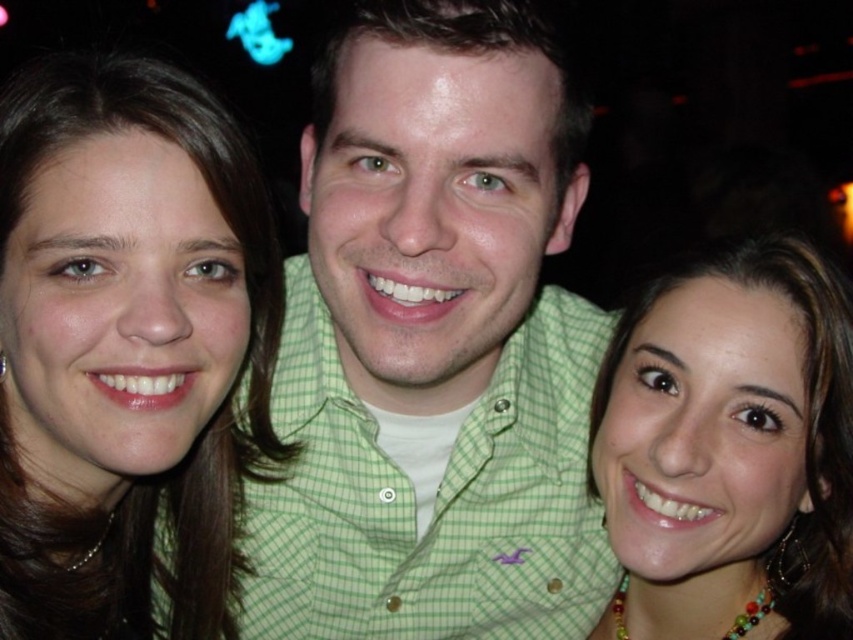
Question: Does matte brown hair at center have a smaller size compared to matte gold necklace at lower right?

Choices:
 (A) no
 (B) yes

Answer: (A)

Question: Which of the following is the closest to the observer?

Choices:
 (A) (57, 371)
 (B) (376, 595)

Answer: (A)

Question: Based on their relative distances, which object is nearer to the matte brown hair at center?

Choices:
 (A) green checkered shirt at center
 (B) matte gold necklace at lower right

Answer: (A)

Question: Which of the following is the farthest from the observer?

Choices:
 (A) (839, 545)
 (B) (561, 381)
 (C) (134, 253)

Answer: (B)

Question: Can you confirm if green checkered shirt at center is positioned to the right of matte brown hair at center?

Choices:
 (A) no
 (B) yes

Answer: (B)

Question: Is green checkered shirt at center smaller than matte brown hair at center?

Choices:
 (A) yes
 (B) no

Answer: (B)